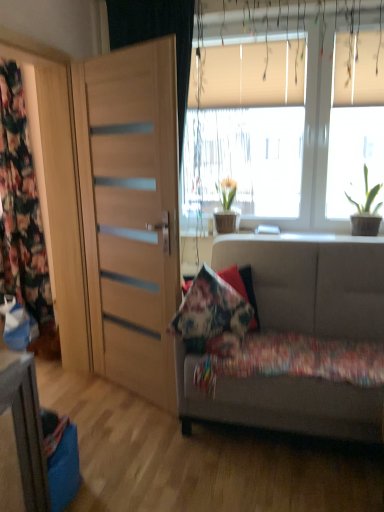
What is the approximate width of floral fabric curtain at left?

The width of floral fabric curtain at left is 8.40 inches.

Measure the distance between floral fabric cushion at lower right and camera.

The depth of floral fabric cushion at lower right is 1.90 meters.

I want to click on floral fabric pillow at center, so click(x=212, y=316).

Describe the element at coordinates (212, 316) in the screenshot. I see `floral fabric pillow at center` at that location.

Locate an element on the screen. The width and height of the screenshot is (384, 512). green matte plant at upper right, positioned as the 1th houseplant in right-to-left order is located at coordinates (366, 211).

Is light wood door at left positioned far away from floral fabric pillow at center?

They are positioned close to each other.

From the image's perspective, which one is positioned higher, light wood door at left or floral fabric pillow at center?

light wood door at left is shown above in the image.

At what (x,y) coordinates should I click in order to perform the action: click on pillow beneath the light wood door at left (from a real-world perspective). Please return your answer as a coordinate pair (x, y). The height and width of the screenshot is (512, 384). Looking at the image, I should click on (212, 316).

Which is correct: light wood door at left is inside floral fabric pillow at center, or outside of it?

light wood door at left is outside floral fabric pillow at center.

Looking at their sizes, would you say white matte window at upper center is wider or thinner than floral fabric cushion at lower right?

In the image, white matte window at upper center appears to be more narrow than floral fabric cushion at lower right.

From the picture: Can you confirm if white matte window at upper center is positioned to the left of floral fabric cushion at lower right?

In fact, white matte window at upper center is to the right of floral fabric cushion at lower right.

Is white matte window at upper center far away from floral fabric cushion at lower right?

Yes, white matte window at upper center and floral fabric cushion at lower right are located far from each other.

Locate an element on the screen. This screenshot has width=384, height=512. bedding in front of the white matte window at upper center is located at coordinates (293, 360).

Does textured beige couch at lower right come in front of green matte plant at upper right, the 2th houseplant positioned from the back?

Yes, textured beige couch at lower right is closer to the viewer.

Considering the sizes of textured beige couch at lower right and green matte plant at upper right, positioned as the 1th houseplant in right-to-left order, in the image, is textured beige couch at lower right wider or thinner than green matte plant at upper right, positioned as the 1th houseplant in right-to-left order,?

Considering their sizes, textured beige couch at lower right looks broader than green matte plant at upper right, positioned as the 1th houseplant in right-to-left order.

Do you think textured beige couch at lower right is within green matte plant at upper right, which is counted as the 2th houseplant, starting from the left, or outside of it?

textured beige couch at lower right is spatially situated outside green matte plant at upper right, which is counted as the 2th houseplant, starting from the left.

Could you tell me if textured beige couch at lower right is turned towards green matte plant at upper right, the 2th houseplant positioned from the back?

No.

From the image's perspective, is floral fabric pillow at center located above or below white matte window at upper center?

floral fabric pillow at center is situated lower than white matte window at upper center in the image.

Can you confirm if floral fabric pillow at center is taller than white matte window at upper center?

Incorrect, the height of floral fabric pillow at center is not larger of that of white matte window at upper center.

Is floral fabric pillow at center outside of white matte window at upper center?

floral fabric pillow at center is positioned outside white matte window at upper center.

This screenshot has height=512, width=384. In order to click on window lying on the right of floral fabric pillow at center in this screenshot , I will do `click(285, 115)`.

Consider the image. From the image's perspective, is light wood door at left located beneath green matte plant at center, which is counted as the 2th houseplant, starting from the front?

Yes, from the image's perspective, light wood door at left is beneath green matte plant at center, which is counted as the 2th houseplant, starting from the front.

From a real-world perspective, who is located higher, light wood door at left or green matte plant at center, marked as the first houseplant in a back-to-front arrangement?

green matte plant at center, marked as the first houseplant in a back-to-front arrangement, from a real-world perspective.

Considering the points (170, 155) and (232, 223), which point is behind, point (170, 155) or point (232, 223)?

The point (232, 223) is behind.

In the image, is light wood door at left positioned in front of or behind green matte plant at center, which is counted as the 2th houseplant, starting from the front?

Visually, light wood door at left is located in front of green matte plant at center, which is counted as the 2th houseplant, starting from the front.

From a real-world perspective, which object stands above the other?

From a 3D spatial view, green matte plant at upper right, the first houseplant when ordered from front to back, is above.

Between light wood door at left and green matte plant at upper right, positioned as the 1th houseplant in right-to-left order, which one appears on the left side from the viewer's perspective?

light wood door at left is more to the left.

Which object is further away from the camera, light wood door at left or green matte plant at upper right, which is counted as the 2th houseplant, starting from the left?

green matte plant at upper right, which is counted as the 2th houseplant, starting from the left.

From the image's perspective, is light wood door at left located above or below green matte plant at upper right, the first houseplant when ordered from front to back?

Clearly, from the image's perspective, light wood door at left is below green matte plant at upper right, the first houseplant when ordered from front to back.

Based on the photo, is green matte plant at center, which appears as the first houseplant when viewed from the left, behind textured beige couch at lower right?

Yes, green matte plant at center, which appears as the first houseplant when viewed from the left, is further from the viewer.

Which is more to the right, green matte plant at center, the 2th houseplant from the right, or textured beige couch at lower right?

Positioned to the right is textured beige couch at lower right.

From the image's perspective, which one is positioned higher, green matte plant at center, which appears as the first houseplant when viewed from the left, or textured beige couch at lower right?

From the image's view, green matte plant at center, which appears as the first houseplant when viewed from the left, is above.

Considering the relative sizes of green matte plant at center, marked as the first houseplant in a back-to-front arrangement, and textured beige couch at lower right in the image provided, is green matte plant at center, marked as the first houseplant in a back-to-front arrangement, shorter than textured beige couch at lower right?

Yes.

This screenshot has width=384, height=512. I want to click on pillow that is behind the light wood door at left, so click(x=212, y=316).

The image size is (384, 512). Find the location of `window to the right of floral fabric cushion at lower right`. window to the right of floral fabric cushion at lower right is located at coordinates (285, 115).

When comparing their distances from floral fabric curtain at left, does floral fabric cushion at lower right or floral fabric pillow at center seem closer?

floral fabric pillow at center is closer to floral fabric curtain at left.

Looking at the image, which one is located further to white matte window at upper center, floral fabric cushion at lower right or floral fabric pillow at center?

floral fabric cushion at lower right is further to white matte window at upper center.

Considering their positions, is floral fabric pillow at center positioned further to floral fabric cushion at lower right than textured beige couch at lower right?

Based on the image, floral fabric pillow at center appears to be further to floral fabric cushion at lower right.

Which object lies nearer to the anchor point light wood door at left, floral fabric cushion at lower right or floral fabric curtain at left?

floral fabric cushion at lower right.

Based on their spatial positions, is floral fabric cushion at lower right or floral fabric curtain at left closer to textured beige couch at lower right?

floral fabric cushion at lower right is closer to textured beige couch at lower right.

Looking at the image, which one is located closer to green matte plant at upper right, the first houseplant when ordered from front to back, floral fabric pillow at center or floral fabric cushion at lower right?

floral fabric cushion at lower right lies closer to green matte plant at upper right, the first houseplant when ordered from front to back, than the other object.

In the scene shown: Looking at the image, which one is located closer to floral fabric curtain at left, white matte window at upper center or floral fabric pillow at center?

The object closer to floral fabric curtain at left is white matte window at upper center.

Looking at the image, which one is located further to green matte plant at center, which appears as the first houseplant when viewed from the left, floral fabric cushion at lower right or textured beige couch at lower right?

The object further to green matte plant at center, which appears as the first houseplant when viewed from the left, is textured beige couch at lower right.

This screenshot has width=384, height=512. I want to click on houseplant situated between floral fabric curtain at left and white matte window at upper center from left to right, so click(226, 208).

Where is `pillow between light wood door at left and textured beige couch at lower right in the horizontal direction`? The width and height of the screenshot is (384, 512). pillow between light wood door at left and textured beige couch at lower right in the horizontal direction is located at coordinates (212, 316).

I want to click on pillow between textured beige couch at lower right and green matte plant at center, which appears as the first houseplant when viewed from the left, along the z-axis, so click(212, 316).

This screenshot has width=384, height=512. I want to click on studio couch between white matte window at upper center and floral fabric cushion at lower right in the up-down direction, so click(x=312, y=282).